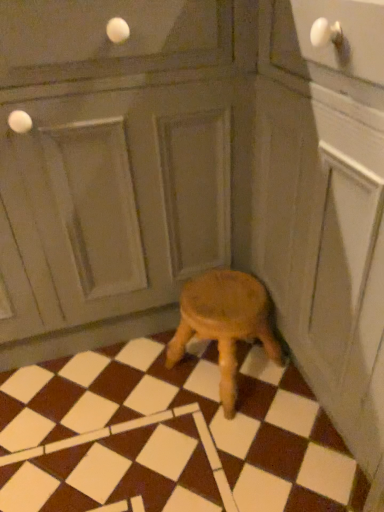
Question: Considering the positions of point (61, 180) and point (173, 458), is point (61, 180) closer or farther from the camera than point (173, 458)?

Choices:
 (A) farther
 (B) closer

Answer: (B)

Question: Is matte gray screen door at center taller or shorter than brown matte tile at center?

Choices:
 (A) tall
 (B) short

Answer: (A)

Question: Which of these objects is positioned closest to the matte gray screen door at center?

Choices:
 (A) wooden stool at center
 (B) brown matte tile at center

Answer: (A)

Question: Which is farther from the wooden stool at center?

Choices:
 (A) brown matte tile at center
 (B) matte gray screen door at center

Answer: (B)